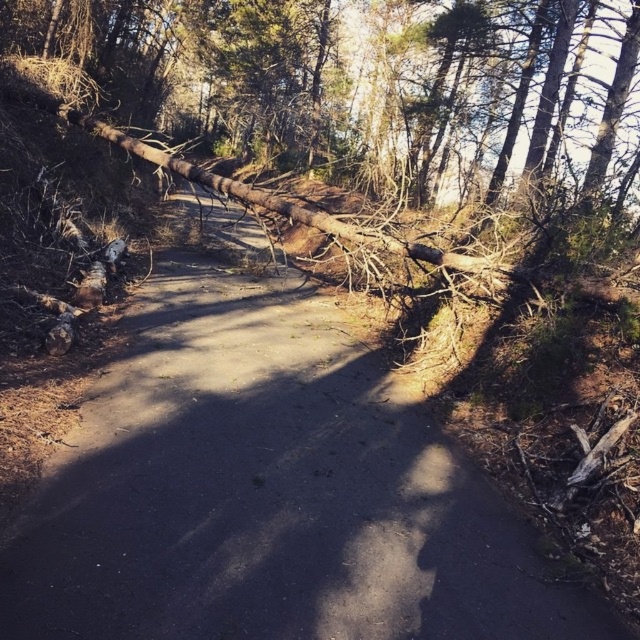
Based on the photo, does brown dirt path at center have a greater width compared to brown rough log at upper center?

In fact, brown dirt path at center might be narrower than brown rough log at upper center.

Does brown dirt path at center have a lesser height compared to brown rough log at upper center?

Correct, brown dirt path at center is not as tall as brown rough log at upper center.

Which is behind, point (316, 429) or point (67, 49)?

The point (67, 49) is behind.

This screenshot has height=640, width=640. Identify the location of brown dirt path at center. click(269, 492).